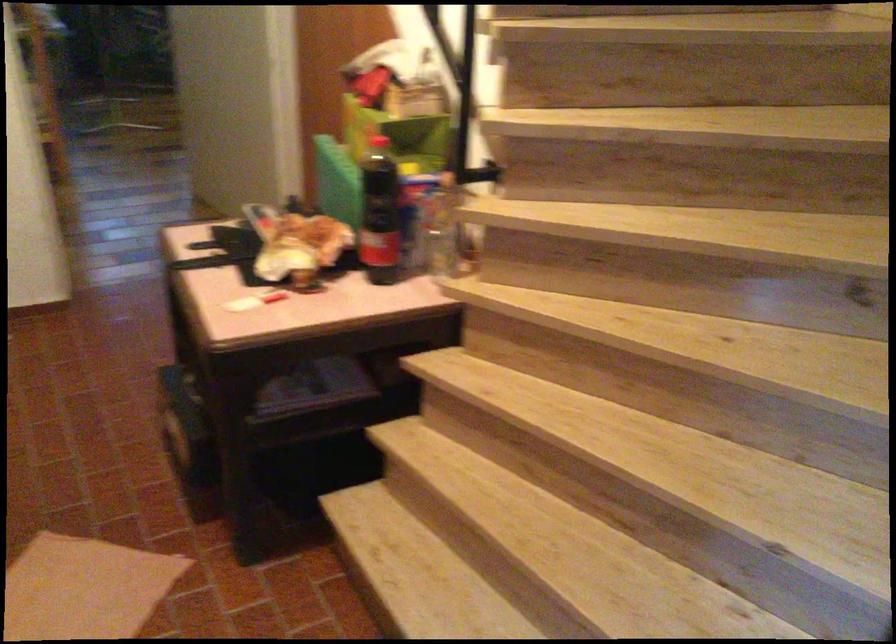
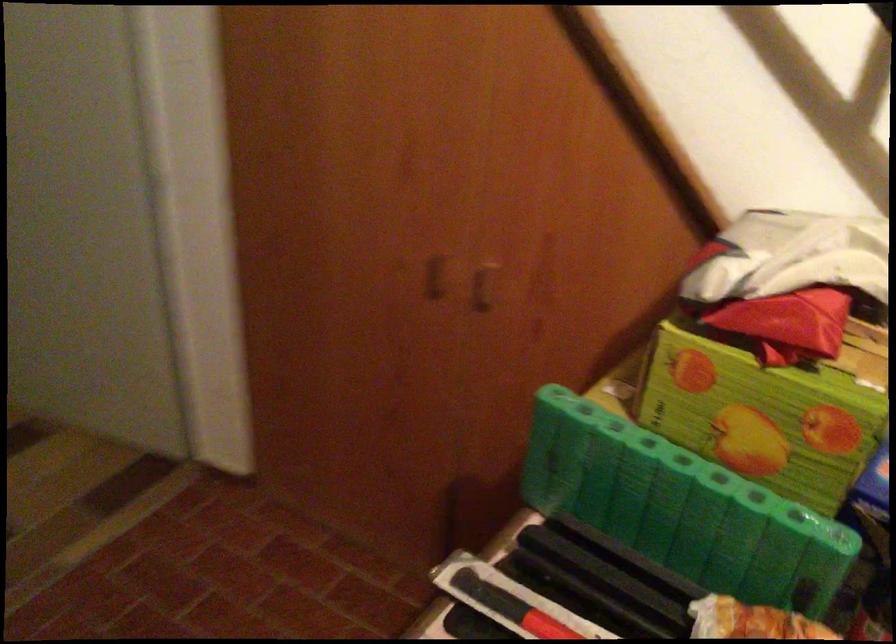
In the second image, find the point that corresponds to [259,222] in the first image.

(510, 605)